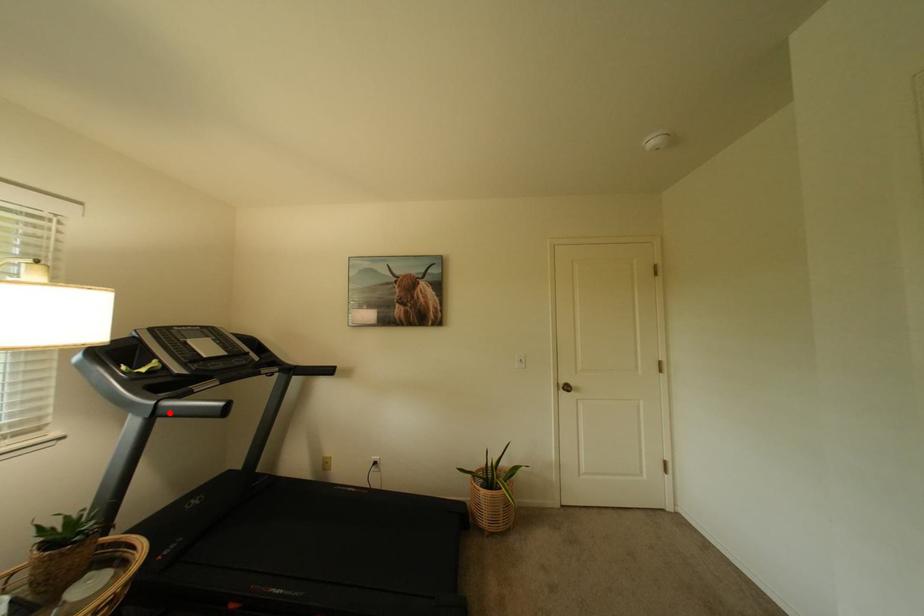
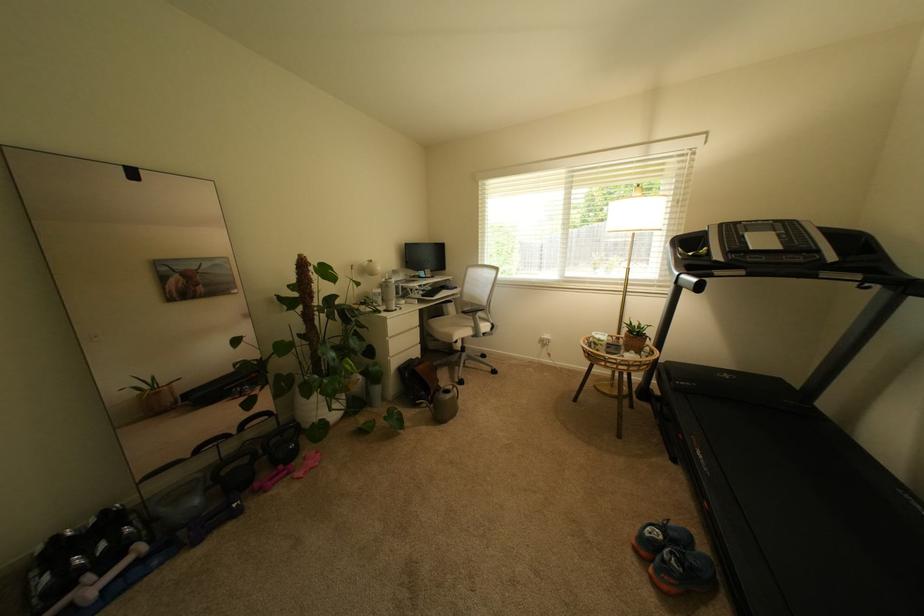
Question: I am providing you with two images of the same scene from different viewpoints. A red point is marked on the first image. Can you still see the location of the red point in image 2?

Choices:
 (A) Yes
 (B) No

Answer: (A)